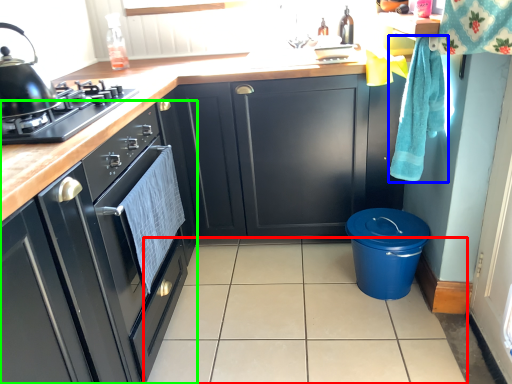
Question: Which object is positioned closest to tile (highlighted by a red box)? Select from hand towel (highlighted by a blue box) and cabinetry (highlighted by a green box).

Choices:
 (A) hand towel
 (B) cabinetry

Answer: (B)